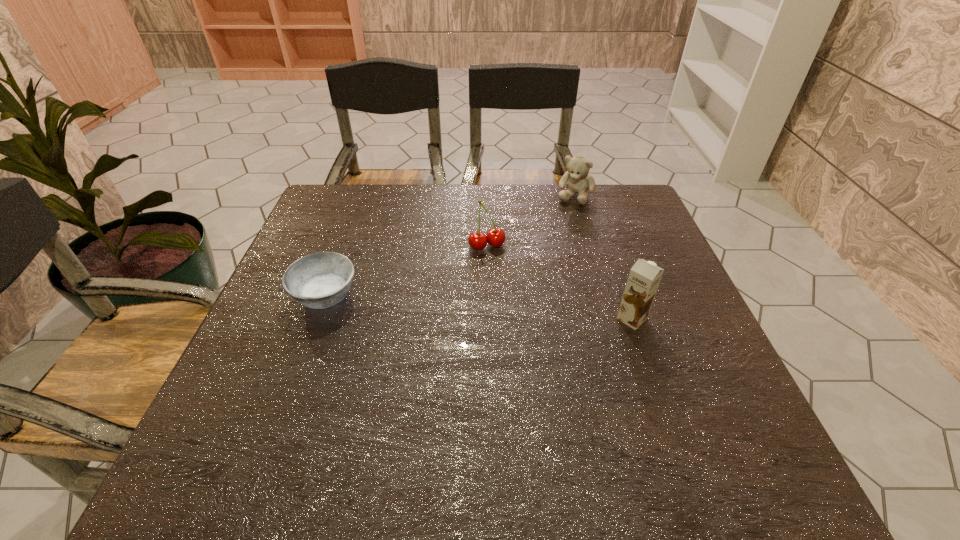
Identify the location of vacant space on the desktop that is between the shortest object and the chocolate milk and is positioned with the stems of the cherry pointing upwards. Image resolution: width=960 pixels, height=540 pixels. (519, 310).

Identify the location of vacant spot on the desktop that is between the shortest object and the tallest object and is positioned on the face of the teddy bear. (516, 310).